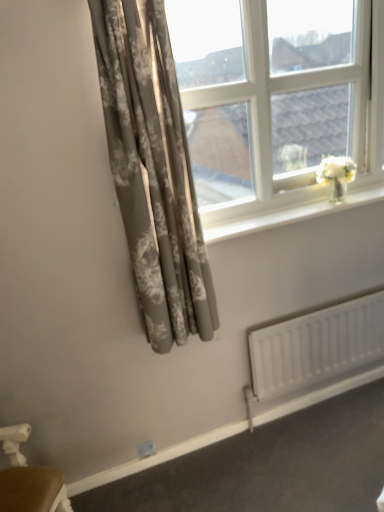
Locate an element on the screen. This screenshot has height=512, width=384. vacant space that is to the left of white matte radiator at lower right is located at coordinates (246, 456).